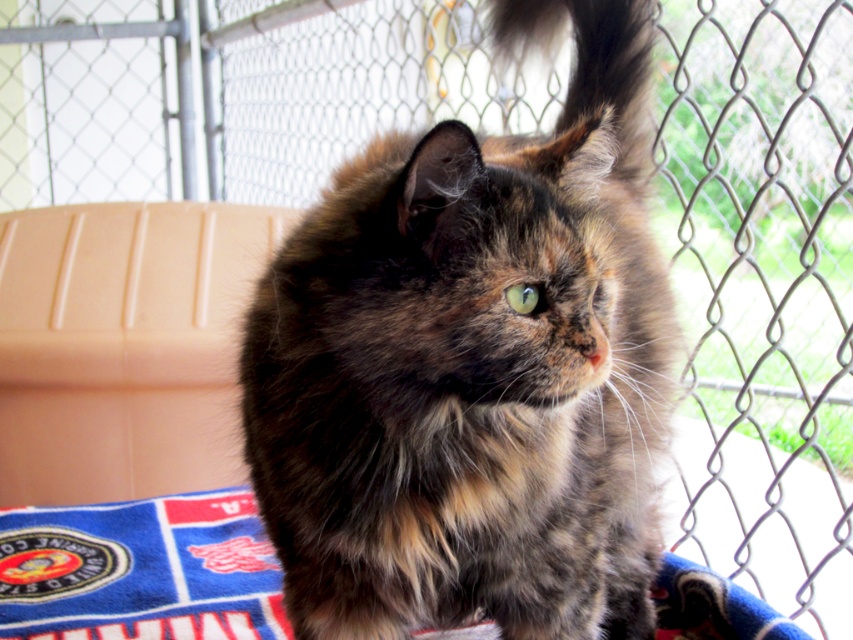
You are a veterinarian assessing the size of the fluffy tortoiseshell cat at center and the blue fleece mat at center. Which object is larger?

The fluffy tortoiseshell cat at center is bigger than the blue fleece mat at center according to the description.

Consider the image. You are a photographer trying to capture the fluffy tortoiseshell cat at center and the blue fleece mat at center in a single shot. Based on their heights, which one will appear larger in the photo?

The fluffy tortoiseshell cat at center is taller than the blue fleece mat at center, so it will appear larger in the photo.

You are a photographer trying to capture the tortoiseshell cat in the image. The cat is currently at point [473,368]. If you want to position the cat exactly in the center of your camera frame, which coordinates should you aim for?

The point [473,368] marks the fluffy tortoiseshell cat at center, so you should aim for those coordinates to center the cat in your frame.